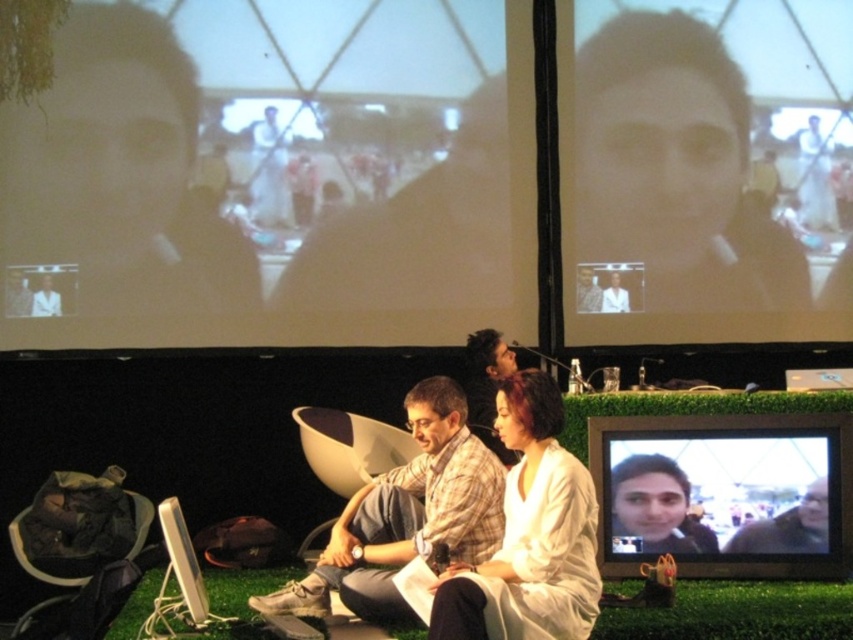
Is matte black screen at upper center positioned before green grass at lower center?

No, matte black screen at upper center is further to the viewer.

Is matte black screen at upper center to the right of green grass at lower center from the viewer's perspective?

Indeed, matte black screen at upper center is positioned on the right side of green grass at lower center.

Who is more forward, (689, 52) or (750, 616)?

Point (750, 616)

Where is `matte black screen at upper center`? The width and height of the screenshot is (853, 640). matte black screen at upper center is located at coordinates (672, 188).

Is matte black screen at upper center to the left of smooth skin face at center from the viewer's perspective?

Incorrect, matte black screen at upper center is not on the left side of smooth skin face at center.

Is matte black screen at upper center thinner than smooth skin face at center?

No, matte black screen at upper center is not thinner than smooth skin face at center.

Is point (631, 148) positioned in front of point (619, 289)?

That is False.

Where is `matte black screen at upper center`? This screenshot has height=640, width=853. matte black screen at upper center is located at coordinates (672, 188).

Is matte black screen at upper center positioned in front of white matte dress at center?

No, it is behind white matte dress at center.

Who is more distant from viewer, (648, 35) or (541, 620)?

Positioned behind is point (648, 35).

This screenshot has width=853, height=640. What are the coordinates of `matte black screen at upper center` in the screenshot? It's located at (672, 188).